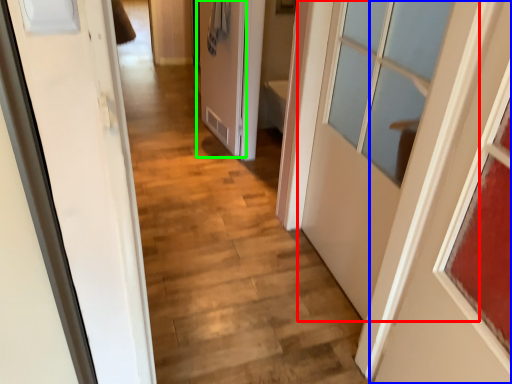
Question: Considering the real-world distances, which object is closest to door (highlighted by a red box)? door (highlighted by a blue box) or door (highlighted by a green box).

Choices:
 (A) door
 (B) door

Answer: (A)